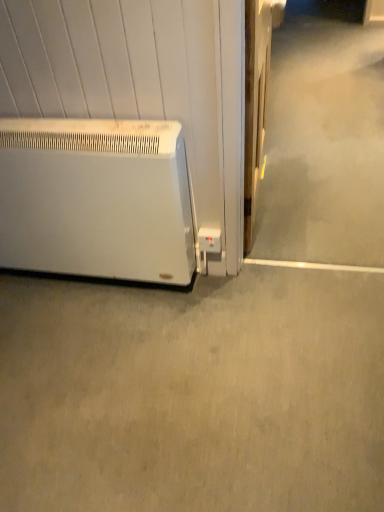
What do you see at coordinates (96, 199) in the screenshot? I see `white matte heater at lower left` at bounding box center [96, 199].

Image resolution: width=384 pixels, height=512 pixels. I want to click on white matte heater at lower left, so click(96, 199).

Measure the distance between white matte heater at lower left and camera.

They are 4.23 feet apart.

Measure the distance between point (169, 180) and camera.

Point (169, 180) and camera are 4.44 feet apart from each other.

This screenshot has width=384, height=512. What do you see at coordinates (193, 393) in the screenshot?
I see `gray matte concrete at lower left` at bounding box center [193, 393].

Find the location of `gray matte concrete at lower left`. gray matte concrete at lower left is located at coordinates (193, 393).

Measure the distance between gray matte concrete at lower left and camera.

gray matte concrete at lower left and camera are 1.16 meters apart.

Locate an element on the screen. The height and width of the screenshot is (512, 384). white matte heater at lower left is located at coordinates click(96, 199).

Would you say white matte heater at lower left is to the left or to the right of gray matte concrete at lower left in the picture?

Clearly, white matte heater at lower left is on the left of gray matte concrete at lower left in the image.

Which object is further away from the camera, white matte heater at lower left or gray matte concrete at lower left?

white matte heater at lower left is behind.

Does point (24, 257) come in front of point (192, 345)?

No, (24, 257) is behind (192, 345).

Looking at this image, from the image's perspective, does white matte heater at lower left appear higher than gray matte concrete at lower left?

Yes, from the image's perspective, white matte heater at lower left is over gray matte concrete at lower left.

From the picture: From a real-world perspective, is white matte heater at lower left above or below gray matte concrete at lower left?

white matte heater at lower left is situated higher than gray matte concrete at lower left in the real world.

Considering the sizes of objects white matte heater at lower left and gray matte concrete at lower left in the image provided, who is thinner, white matte heater at lower left or gray matte concrete at lower left?

white matte heater at lower left.

In terms of height, does white matte heater at lower left look taller or shorter compared to gray matte concrete at lower left?

In the image, white matte heater at lower left appears to be taller than gray matte concrete at lower left.

Which of these two, white matte heater at lower left or gray matte concrete at lower left, is bigger?

white matte heater at lower left.

Is white matte heater at lower left located outside gray matte concrete at lower left?

Indeed, white matte heater at lower left is completely outside gray matte concrete at lower left.

Is white matte heater at lower left not near gray matte concrete at lower left?

Answer: No, white matte heater at lower left is in close proximity to gray matte concrete at lower left.

Does white matte heater at lower left turn towards gray matte concrete at lower left?

No.

This screenshot has height=512, width=384. In order to click on home appliance to the left of gray matte concrete at lower left in this screenshot , I will do `click(96, 199)`.

Considering the relative positions of gray matte concrete at lower left and white matte heater at lower left in the image provided, is gray matte concrete at lower left to the left of white matte heater at lower left from the viewer's perspective?

No.

Consider the image. In the image, is gray matte concrete at lower left positioned in front of or behind white matte heater at lower left?

gray matte concrete at lower left is in front of white matte heater at lower left.

Does point (306, 370) appear closer or farther from the camera than point (81, 262)?

Point (306, 370) appears to be closer to the viewer than point (81, 262).

From the image's perspective, is gray matte concrete at lower left located above or below white matte heater at lower left?

From the image's perspective, gray matte concrete at lower left appears below white matte heater at lower left.

From a real-world perspective, is gray matte concrete at lower left above or below white matte heater at lower left?

gray matte concrete at lower left is situated lower than white matte heater at lower left in the real world.

Which of these two, gray matte concrete at lower left or white matte heater at lower left, is thinner?

Thinner between the two is white matte heater at lower left.

Does gray matte concrete at lower left have a greater height compared to white matte heater at lower left?

No.

Does gray matte concrete at lower left have a larger size compared to white matte heater at lower left?

No, gray matte concrete at lower left is not bigger than white matte heater at lower left.

Is gray matte concrete at lower left outside of white matte heater at lower left?

Yes, gray matte concrete at lower left is located beyond the bounds of white matte heater at lower left.

Are gray matte concrete at lower left and white matte heater at lower left located far from each other?

No, gray matte concrete at lower left is not far away from white matte heater at lower left.

Is gray matte concrete at lower left oriented away from white matte heater at lower left?

No.

How many degrees apart are the facing directions of gray matte concrete at lower left and white matte heater at lower left?

They differ by 180 degrees in their facing directions.

The image size is (384, 512). What are the coordinates of `home appliance behind the gray matte concrete at lower left` in the screenshot? It's located at (96, 199).

Locate an element on the screen. The height and width of the screenshot is (512, 384). home appliance on the left of gray matte concrete at lower left is located at coordinates [x=96, y=199].

Find the location of `concrete lying below the white matte heater at lower left (from the image's perspective)`. concrete lying below the white matte heater at lower left (from the image's perspective) is located at coordinates (193, 393).